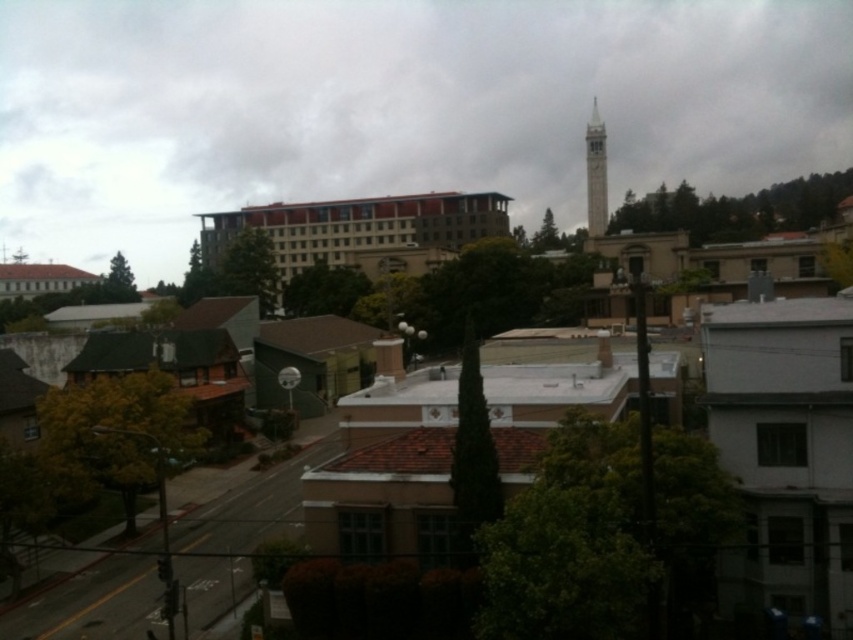
You are an architect analyzing the cityscape. Based on the scene, which object is taller between the white stone tower at center and the smooth white bell tower at upper center?

The white stone tower at center is much taller than the smooth white bell tower at upper center.